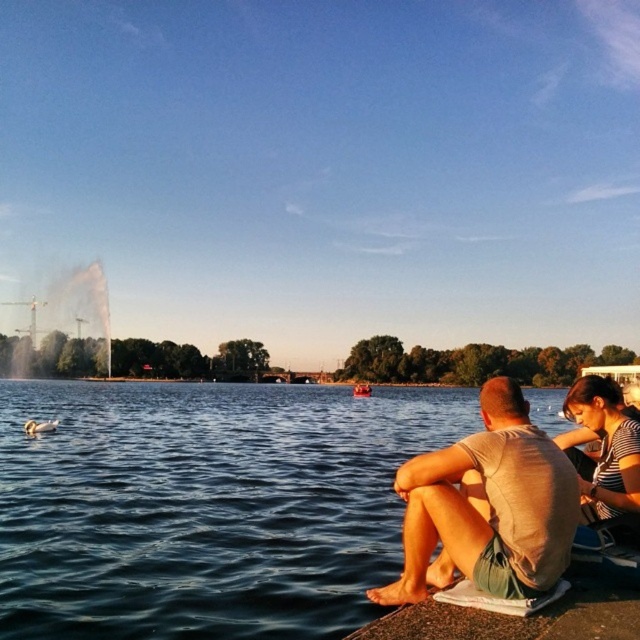
You are planning to take a photo of the blue water at lower left and wooden boat at center. Which object should be placed higher in the frame to ensure both are fully visible?

The blue water at lower left is taller than the wooden boat at center, so to ensure both are fully visible in the frame, the blue water at lower left should be placed higher since it has a greater height requirement.

You are standing at the lakeside and see the blue water at lower left and the wooden boat at center. Which object is positioned to the left of the other?

The blue water at lower left is to the left of the wooden boat at center.